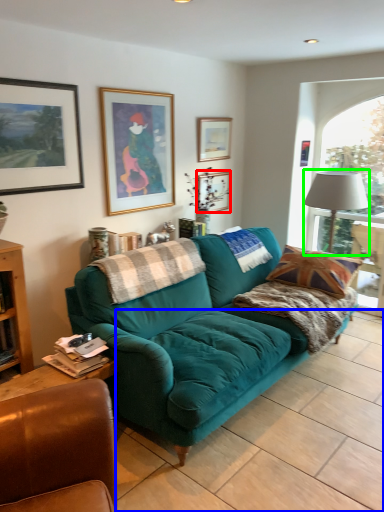
Question: Which is nearer to the picture frame (highlighted by a red box)? tile (highlighted by a blue box) or lamp (highlighted by a green box).

Choices:
 (A) tile
 (B) lamp

Answer: (B)